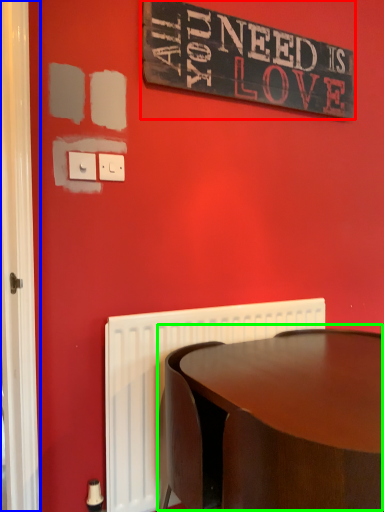
Question: Based on their relative distances, which object is farther from bulletin board (highlighted by a red box)? Choose from screen door (highlighted by a blue box) and table (highlighted by a green box).

Choices:
 (A) screen door
 (B) table

Answer: (B)